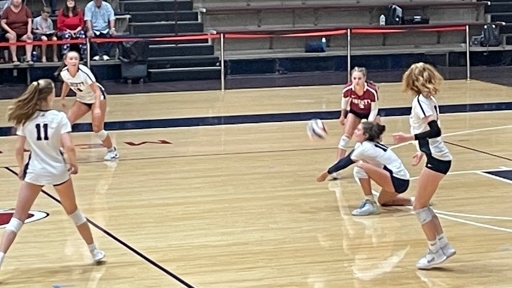
Locate an element on the screen. This screenshot has height=288, width=512. trash can is located at coordinates (132, 72).